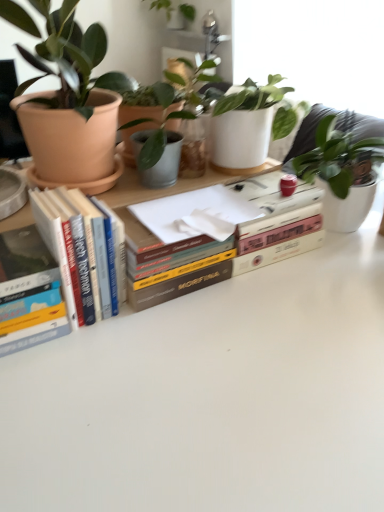
Question: Is hardcover books at left, acting as the second book starting from the left, at the left side of hardcover book at center, marked as the 1th book in a right-to-left arrangement?

Choices:
 (A) yes
 (B) no

Answer: (A)

Question: Is the position of hardcover books at left, acting as the second book starting from the left, more distant than that of hardcover book at center, marked as the 1th book in a right-to-left arrangement?

Choices:
 (A) yes
 (B) no

Answer: (B)

Question: Considering the relative sizes of hardcover books at left, acting as the second book starting from the left, and hardcover book at center, marked as the 1th book in a right-to-left arrangement, in the image provided, is hardcover books at left, acting as the second book starting from the left, smaller than hardcover book at center, marked as the 1th book in a right-to-left arrangement,?

Choices:
 (A) no
 (B) yes

Answer: (B)

Question: Can you confirm if hardcover books at left, acting as the second book starting from the left, is wider than hardcover book at center, marked as the 1th book in a right-to-left arrangement?

Choices:
 (A) yes
 (B) no

Answer: (B)

Question: From the image's perspective, is hardcover books at left, the 2th book from the right, above hardcover book at center, marked as the 1th book in a right-to-left arrangement?

Choices:
 (A) yes
 (B) no

Answer: (B)

Question: Considering the positions of hardcover books at left, acting as the second book starting from the left, and hardcover book at center, the third book in the left-to-right sequence, in the image, is hardcover books at left, acting as the second book starting from the left, wider or thinner than hardcover book at center, the third book in the left-to-right sequence,?

Choices:
 (A) wide
 (B) thin

Answer: (B)

Question: Considering their positions, is hardcover books at left, acting as the second book starting from the left, located in front of or behind hardcover book at center, the third book in the left-to-right sequence?

Choices:
 (A) front
 (B) behind

Answer: (A)

Question: From the image's perspective, is hardcover books at left, acting as the second book starting from the left, positioned above or below hardcover book at center, marked as the 1th book in a right-to-left arrangement?

Choices:
 (A) below
 (B) above

Answer: (A)

Question: In the image, is hardcover books at left, acting as the second book starting from the left, on the left side or the right side of hardcover book at center, the third book in the left-to-right sequence?

Choices:
 (A) left
 (B) right

Answer: (A)

Question: Does point 162,84 appear closer or farther from the camera than point 122,256?

Choices:
 (A) farther
 (B) closer

Answer: (A)

Question: Is matte terracotta pot at upper left, which is the 2th houseplant from front to back, taller or shorter than hardcover books at left, the 2th book from the right?

Choices:
 (A) tall
 (B) short

Answer: (B)

Question: From a real-world perspective, is matte terracotta pot at upper left, which is the first houseplant in bottom-to-top order, physically located above or below hardcover books at left, the 2th book from the right?

Choices:
 (A) below
 (B) above

Answer: (B)

Question: From the image's perspective, is matte terracotta pot at upper left, arranged as the 3th houseplant when viewed from the top, above or below hardcover books at left, acting as the second book starting from the left?

Choices:
 (A) above
 (B) below

Answer: (A)

Question: Is hardcover book at left, the 1th book positioned from the left, to the left or to the right of green matte plant at upper center, which is counted as the 1th houseplant, starting from the top, in the image?

Choices:
 (A) left
 (B) right

Answer: (A)

Question: Is hardcover book at left, the third book in the right-to-left sequence, wider or thinner than green matte plant at upper center, positioned as the 1th houseplant in back-to-front order?

Choices:
 (A) wide
 (B) thin

Answer: (B)